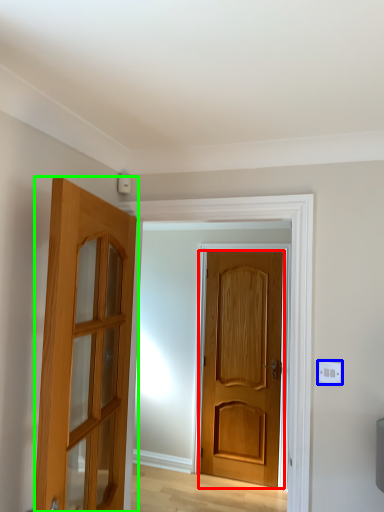
Question: Based on their relative distances, which object is nearer to door (highlighted by a red box)? Choose from electric outlet (highlighted by a blue box) and door (highlighted by a green box).

Choices:
 (A) electric outlet
 (B) door

Answer: (A)